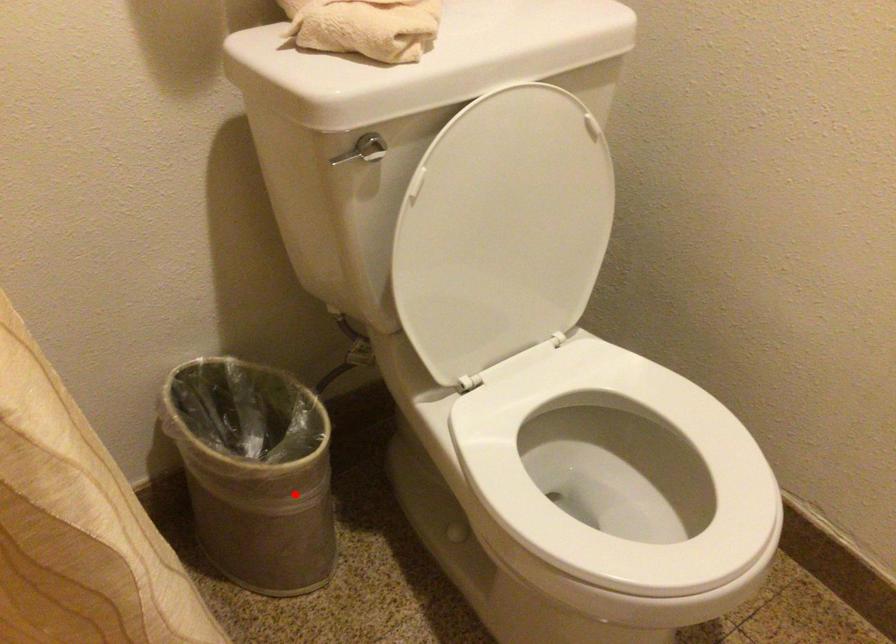
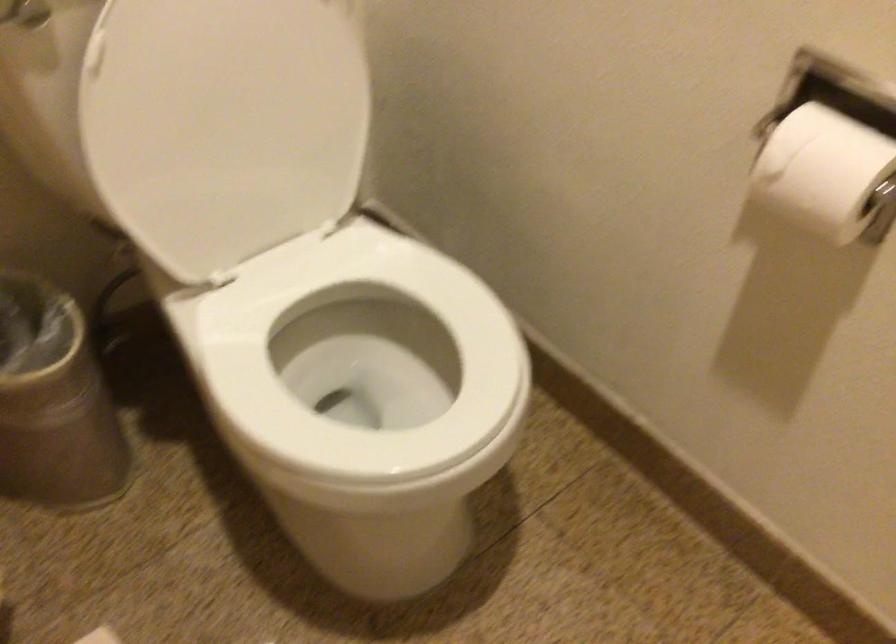
Where in the second image is the point corresponding to the highlighted location from the first image?

(54, 402)